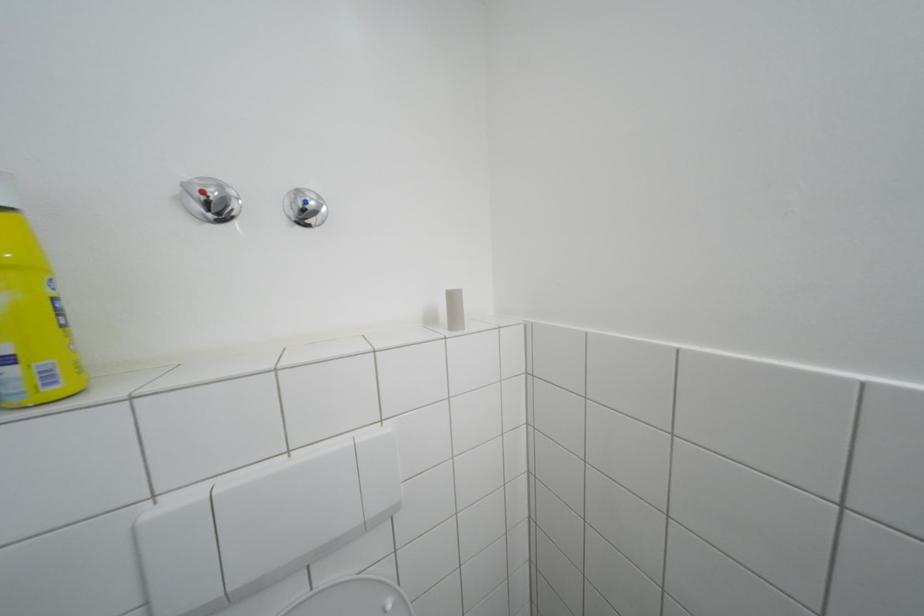
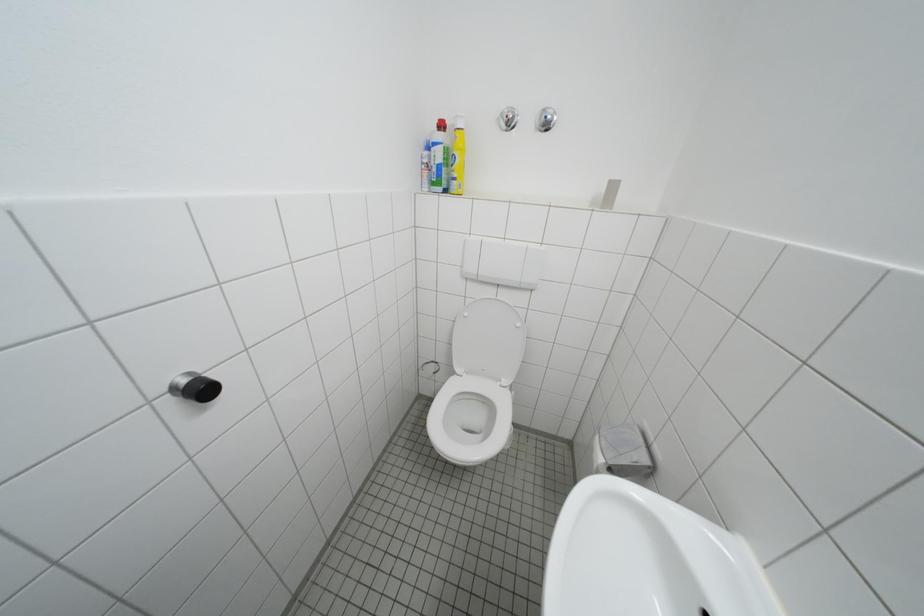
How did the camera likely rotate?

The camera rotated toward left-down.